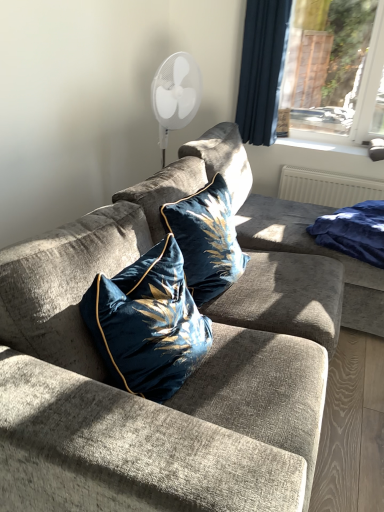
Question: Considering the relative sizes of velvet fabric couch at center and blue velvet blanket at right in the image provided, is velvet fabric couch at center bigger than blue velvet blanket at right?

Choices:
 (A) no
 (B) yes

Answer: (B)

Question: Is velvet fabric couch at center smaller than blue velvet blanket at right?

Choices:
 (A) no
 (B) yes

Answer: (A)

Question: Considering the relative positions of velvet fabric couch at center and blue velvet blanket at right in the image provided, is velvet fabric couch at center to the right of blue velvet blanket at right from the viewer's perspective?

Choices:
 (A) yes
 (B) no

Answer: (B)

Question: Does velvet fabric couch at center have a greater width compared to blue velvet blanket at right?

Choices:
 (A) yes
 (B) no

Answer: (A)

Question: Does velvet fabric couch at center turn towards blue velvet blanket at right?

Choices:
 (A) yes
 (B) no

Answer: (A)

Question: Do you think white plastic window sill at upper right is within dark blue velvet curtain at upper right, or outside of it?

Choices:
 (A) outside
 (B) inside

Answer: (A)

Question: Is white plastic window sill at upper right taller or shorter than dark blue velvet curtain at upper right?

Choices:
 (A) tall
 (B) short

Answer: (B)

Question: Is point (347, 139) positioned closer to the camera than point (289, 3)?

Choices:
 (A) closer
 (B) farther

Answer: (B)

Question: From the image's perspective, relative to dark blue velvet curtain at upper right, is white plastic window sill at upper right above or below?

Choices:
 (A) below
 (B) above

Answer: (A)

Question: Is point (294, 145) closer or farther from the camera than point (352, 234)?

Choices:
 (A) closer
 (B) farther

Answer: (B)

Question: From a real-world perspective, is white plastic window sill at upper right physically located above or below blue velvet blanket at right?

Choices:
 (A) below
 (B) above

Answer: (B)

Question: From the image's perspective, is white plastic window sill at upper right located above or below blue velvet blanket at right?

Choices:
 (A) above
 (B) below

Answer: (A)

Question: Looking at their shapes, would you say white plastic window sill at upper right is wider or thinner than blue velvet blanket at right?

Choices:
 (A) wide
 (B) thin

Answer: (B)

Question: From the image's perspective, is blue velvet blanket at right located above or below velvet blue pillow at center, which is counted as the 1th pillow, starting from the back?

Choices:
 (A) above
 (B) below

Answer: (A)

Question: Does point (329, 238) appear closer or farther from the camera than point (211, 215)?

Choices:
 (A) farther
 (B) closer

Answer: (A)